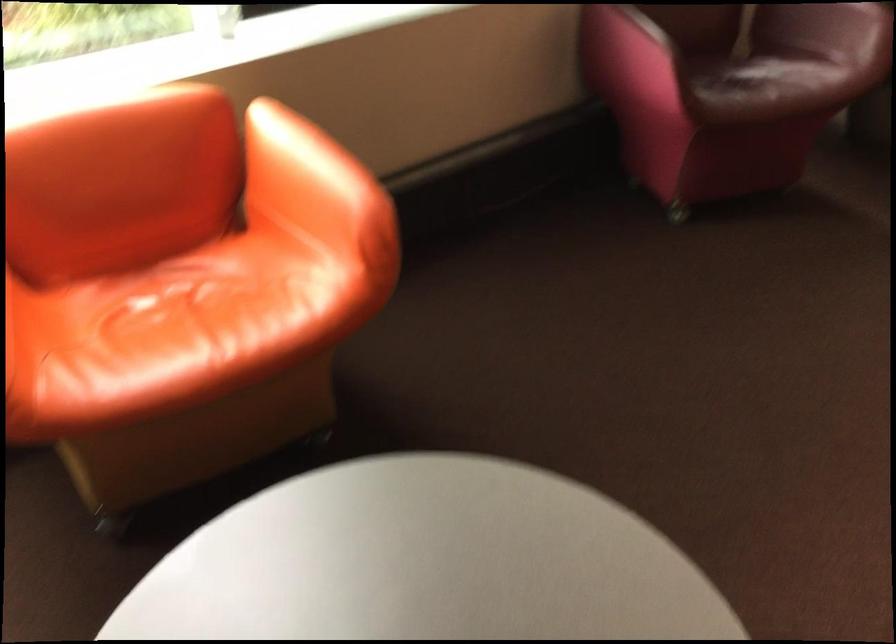
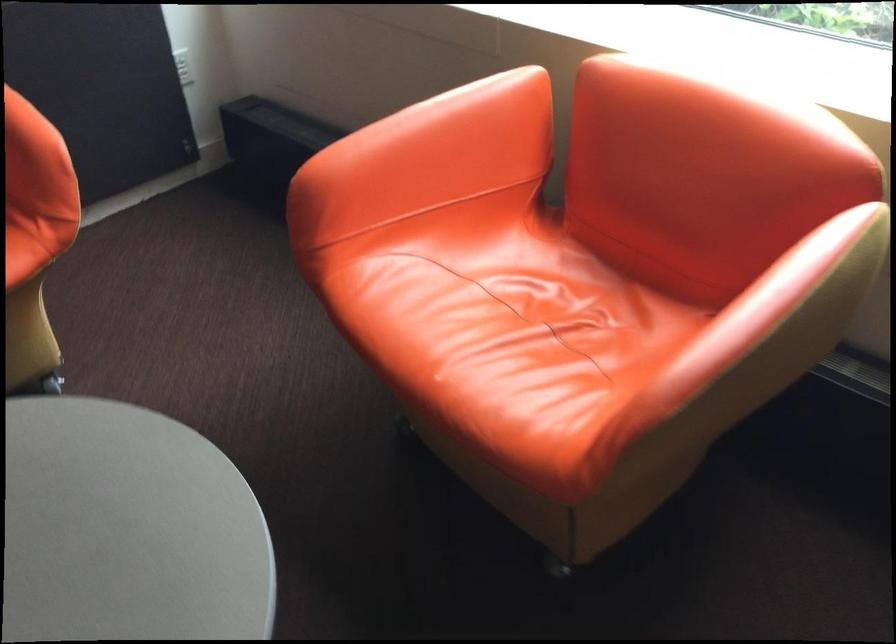
The point at (122, 313) is marked in the first image. Where is the corresponding point in the second image?

(519, 277)